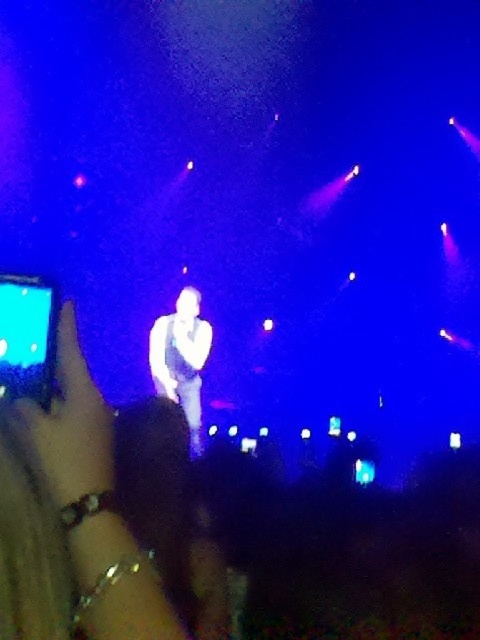
Question: Can you confirm if white matte shirt at center is smaller than metallic bracelet at lower left?

Choices:
 (A) no
 (B) yes

Answer: (A)

Question: Is white matte shirt at center bigger than metallic bracelet at lower left?

Choices:
 (A) no
 (B) yes

Answer: (B)

Question: Which point appears closest to the camera in this image?

Choices:
 (A) (192, 369)
 (B) (98, 420)

Answer: (B)

Question: Among these objects, which one is farthest from the camera?

Choices:
 (A) white matte shirt at center
 (B) metallic bracelet at lower left

Answer: (A)

Question: Can you confirm if white matte shirt at center is positioned to the right of metallic bracelet at lower left?

Choices:
 (A) yes
 (B) no

Answer: (B)

Question: Which of the following is the farthest from the observer?

Choices:
 (A) (194, 394)
 (B) (110, 422)

Answer: (A)